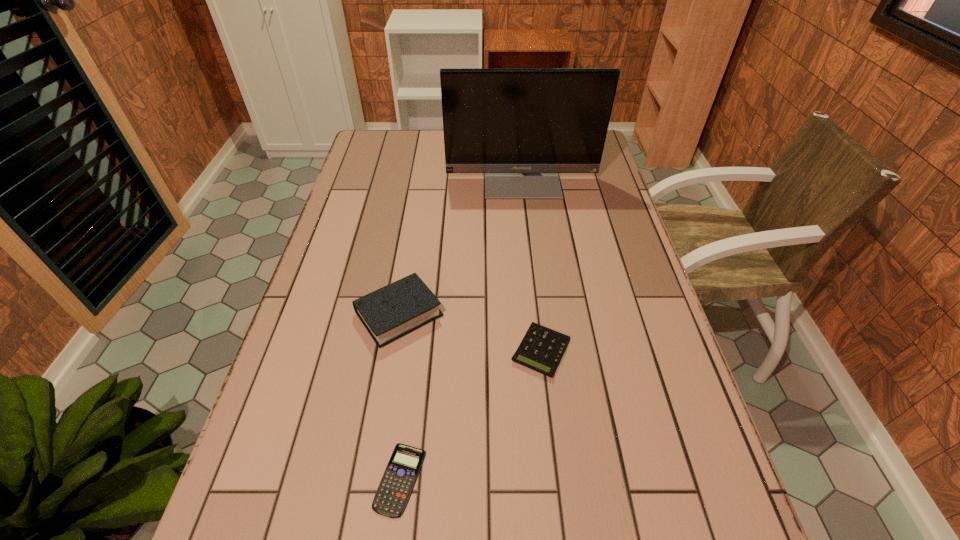
Locate an element on the screen. vacant space located on the right of the nearer calculator is located at coordinates (467, 479).

Where is `object located at the far edge`? The height and width of the screenshot is (540, 960). object located at the far edge is located at coordinates (521, 127).

Locate an element on the screen. The width and height of the screenshot is (960, 540). object that is at the left edge is located at coordinates (397, 309).

Identify the location of object present at the right edge. This screenshot has width=960, height=540. (521, 127).

Locate an element on the screen. object at the far right corner is located at coordinates (521, 127).

The image size is (960, 540). In order to click on vacant space at the left edge of the desktop in this screenshot , I will do `click(293, 427)`.

The width and height of the screenshot is (960, 540). I want to click on vacant space at the right edge of the desktop, so click(607, 166).

In order to click on empty space between the Bible and the farthest object in this screenshot , I will do `click(461, 246)`.

You are a GUI agent. You are given a task and a screenshot of the screen. Output one action in this format:
    pyautogui.click(x=<x>, y=<y>)
    Task: Click on the free area in between the farthest object and the taller calculator
    
    Given the screenshot: What is the action you would take?
    pyautogui.click(x=531, y=264)

You are a GUI agent. You are given a task and a screenshot of the screen. Output one action in this format:
    pyautogui.click(x=<x>, y=<y>)
    Task: Click on the free space between the farthest object and the farther calculator
    Image resolution: width=960 pixels, height=540 pixels.
    Given the screenshot: What is the action you would take?
    pyautogui.click(x=531, y=264)